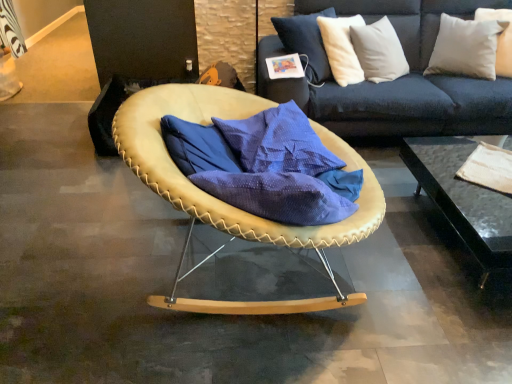
Question: Is black glass table at lower right positioned behind white soft pillow at upper right, placed as the 2th pillow when sorted from left to right?

Choices:
 (A) no
 (B) yes

Answer: (A)

Question: Are black glass table at lower right and white soft pillow at upper right, the 1th pillow viewed from the right, beside each other?

Choices:
 (A) no
 (B) yes

Answer: (A)

Question: Is black glass table at lower right facing away from white soft pillow at upper right, the 1th pillow viewed from the right?

Choices:
 (A) no
 (B) yes

Answer: (A)

Question: Considering the relative sizes of black glass table at lower right and white soft pillow at upper right, placed as the 2th pillow when sorted from left to right, in the image provided, is black glass table at lower right taller than white soft pillow at upper right, placed as the 2th pillow when sorted from left to right,?

Choices:
 (A) yes
 (B) no

Answer: (B)

Question: From the image's perspective, is black glass table at lower right above white soft pillow at upper right, placed as the 2th pillow when sorted from left to right?

Choices:
 (A) no
 (B) yes

Answer: (A)

Question: In the image, is white cotton pillow at upper right, arranged as the 2th pillow when viewed from the right, on the left side or the right side of leather-like beige chair at center?

Choices:
 (A) right
 (B) left

Answer: (A)

Question: From a real-world perspective, is white cotton pillow at upper right, arranged as the first pillow when viewed from the left, physically located above or below leather-like beige chair at center?

Choices:
 (A) below
 (B) above

Answer: (B)

Question: From the image's perspective, is white cotton pillow at upper right, arranged as the 2th pillow when viewed from the right, positioned above or below leather-like beige chair at center?

Choices:
 (A) above
 (B) below

Answer: (A)

Question: Considering the positions of white cotton pillow at upper right, arranged as the first pillow when viewed from the left, and leather-like beige chair at center in the image, is white cotton pillow at upper right, arranged as the first pillow when viewed from the left, wider or thinner than leather-like beige chair at center?

Choices:
 (A) wide
 (B) thin

Answer: (B)

Question: From a real-world perspective, is white soft pillow at upper right, the 1th pillow viewed from the right, physically located above or below leather-like beige chair at center?

Choices:
 (A) below
 (B) above

Answer: (B)

Question: Is white soft pillow at upper right, the 1th pillow viewed from the right, bigger or smaller than leather-like beige chair at center?

Choices:
 (A) small
 (B) big

Answer: (A)

Question: Is white soft pillow at upper right, placed as the 2th pillow when sorted from left to right, taller or shorter than leather-like beige chair at center?

Choices:
 (A) tall
 (B) short

Answer: (B)

Question: In the image, is white soft pillow at upper right, the 1th pillow viewed from the right, positioned in front of or behind leather-like beige chair at center?

Choices:
 (A) front
 (B) behind

Answer: (B)

Question: Would you say black glass table at lower right is to the left or to the right of white cotton pillow at upper right, arranged as the first pillow when viewed from the left, in the picture?

Choices:
 (A) right
 (B) left

Answer: (B)

Question: Considering the positions of black glass table at lower right and white cotton pillow at upper right, arranged as the 2th pillow when viewed from the right, in the image, is black glass table at lower right taller or shorter than white cotton pillow at upper right, arranged as the 2th pillow when viewed from the right,?

Choices:
 (A) tall
 (B) short

Answer: (B)